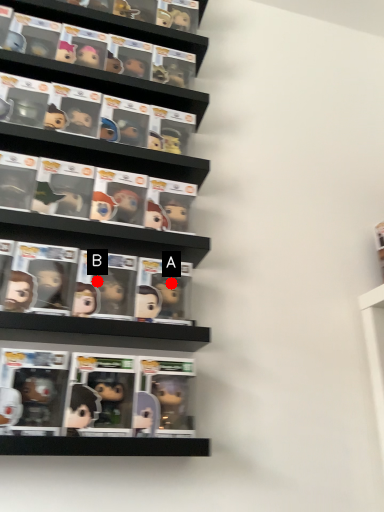
Question: Two points are circled on the image, labeled by A and B beside each circle. Among these points, which one is farthest from the camera?

Choices:
 (A) A is further
 (B) B is further

Answer: (A)